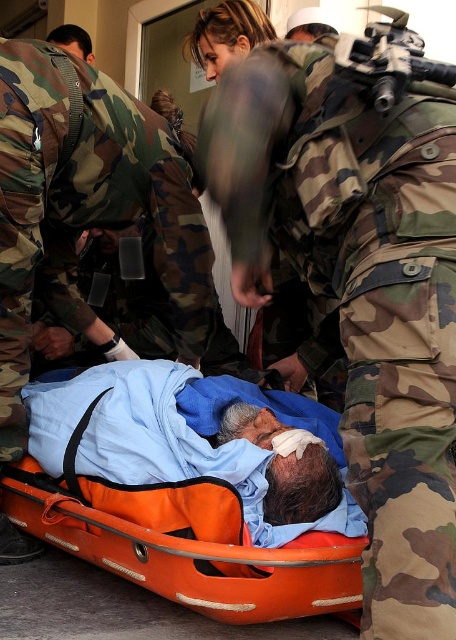
You are a medic trying to locate the injured person on the orange stretcher. There is a camo uniform at center marked by point (358,288). In which direction relative to the camo uniform at center should you look to find the orange stretcher?

The orange stretcher is in the foreground relative to the camo uniform at center marked by point (358,288), so you should look towards the front direction from the camo uniform at center.

You are a medic trying to determine if there is enough space between the camo uniform at center and the orange plastic stretcher at center to place a medical kit. Based on their widths, can you fit the kit between them?

The camo uniform at center has a lesser width compared to orange plastic stretcher at center, so there might be enough space between them to place the medical kit.

Where is the camo uniform at center located in the image?

The camo uniform at center is located at point [358,288] in the image.